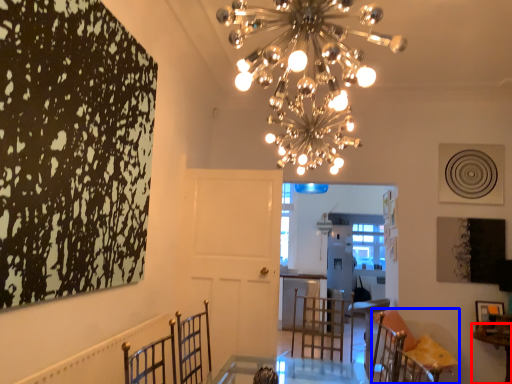
Question: Which point is closer to the camera, table (highlighted by a red box) or furniture (highlighted by a blue box)?

Choices:
 (A) table
 (B) furniture

Answer: (A)